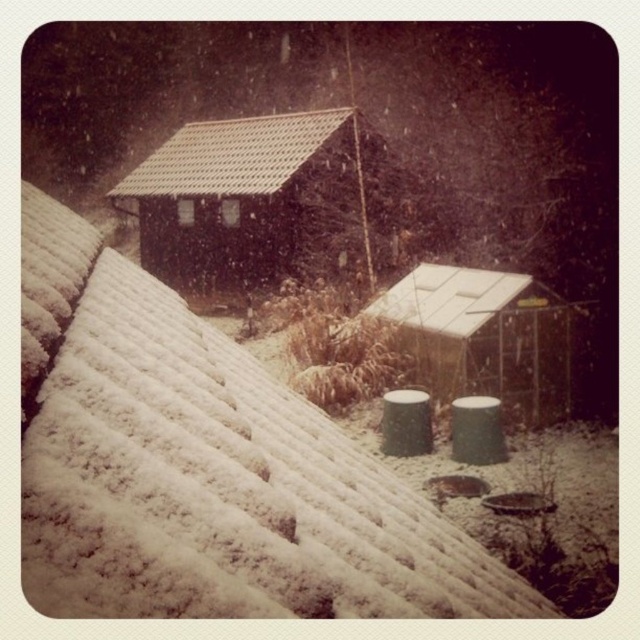
Question: Which of the following is the closest to the observer?

Choices:
 (A) brown tile roof at upper center
 (B) brown wooden hut at upper center

Answer: (B)

Question: Does white plastic shed at center appear on the left side of brown tile roof at upper center?

Choices:
 (A) yes
 (B) no

Answer: (B)

Question: Which point appears farthest from the camera in this image?

Choices:
 (A) pos(220,136)
 (B) pos(424,305)
 (C) pos(198,243)

Answer: (A)

Question: Where is white plastic shed at center located in relation to brown tile roof at upper center in the image?

Choices:
 (A) below
 (B) above

Answer: (A)

Question: Is brown wooden hut at upper center bigger than brown tile roof at upper center?

Choices:
 (A) yes
 (B) no

Answer: (A)

Question: Which object is closer to the camera taking this photo?

Choices:
 (A) white plastic shed at center
 (B) brown wooden hut at upper center
 (C) brown tile roof at upper center

Answer: (A)